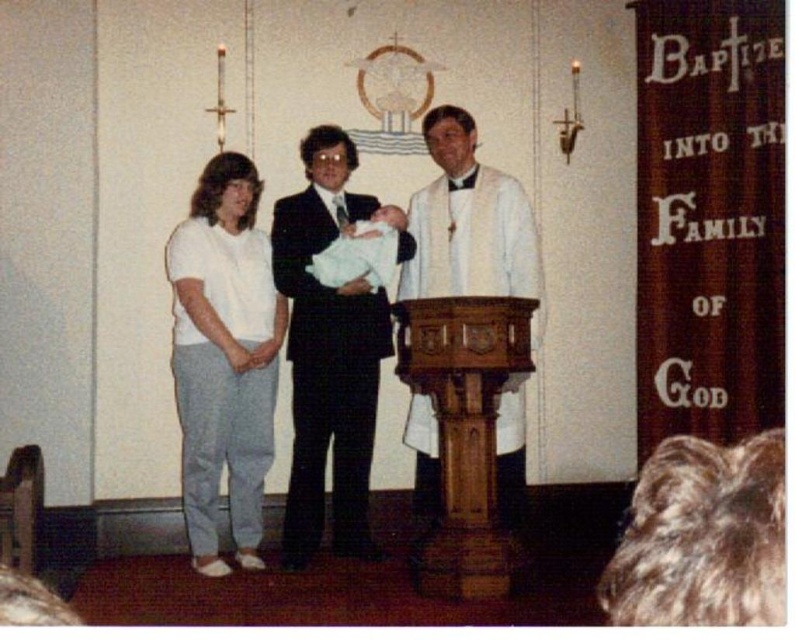
From the picture: Is the position of white cotton pants at left less distant than that of matte black suit at center?

That is True.

Is white cotton pants at left shorter than matte black suit at center?

Indeed, white cotton pants at left has a lesser height compared to matte black suit at center.

Is point (251, 536) farther from viewer compared to point (348, 163)?

No.

Locate an element on the screen. This screenshot has height=640, width=795. white cotton pants at left is located at coordinates (223, 356).

Is matte black suit at center shorter than white soft cloth at center?

In fact, matte black suit at center may be taller than white soft cloth at center.

Between matte black suit at center and white soft cloth at center, which one appears on the left side from the viewer's perspective?

matte black suit at center

At what (x,y) coordinates should I click in order to perform the action: click on matte black suit at center. Please return your answer as a coordinate pair (x, y). Looking at the image, I should click on (330, 352).

Consider the image. Does white clothed man at center appear under white soft cloth at center?

Incorrect, white clothed man at center is not positioned below white soft cloth at center.

Does white clothed man at center appear on the right side of white soft cloth at center?

Correct, you'll find white clothed man at center to the right of white soft cloth at center.

Identify the location of white clothed man at center. (468, 221).